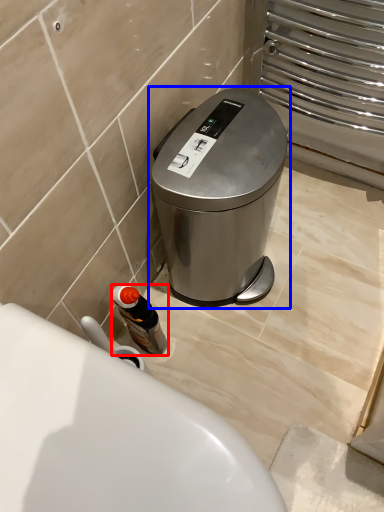
Question: Which point is further to the camera, bottle (highlighted by a red box) or waste container (highlighted by a blue box)?

Choices:
 (A) bottle
 (B) waste container

Answer: (A)